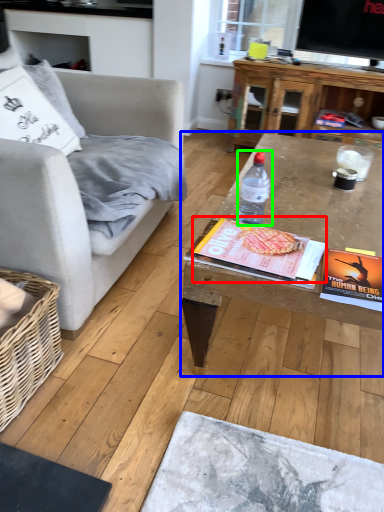
Question: Considering the real-world distances, which object is farthest from magazine (highlighted by a red box)? coffee table (highlighted by a blue box) or bottle (highlighted by a green box)?

Choices:
 (A) coffee table
 (B) bottle

Answer: (A)